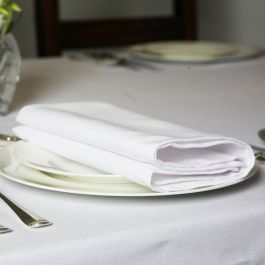
You are a GUI agent. You are given a task and a screenshot of the screen. Output one action in this format:
    pyautogui.click(x=<x>, y=<y>)
    Task: Click on the white fabric napkins
    This screenshot has height=265, width=265.
    Given the screenshot: What is the action you would take?
    pyautogui.click(x=106, y=125), pyautogui.click(x=81, y=58)